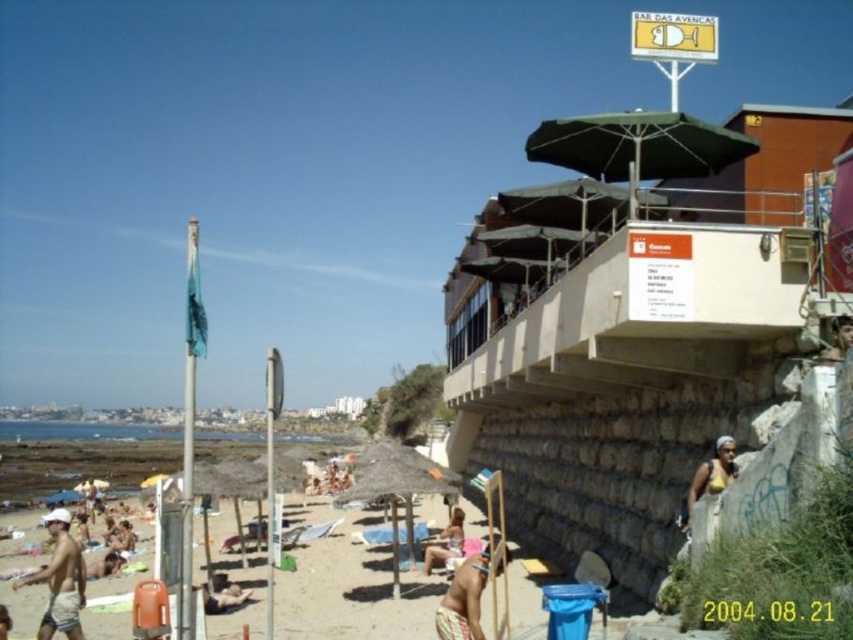
Who is higher up, tan skin person at center or beige straw umbrella at center?

tan skin person at center

How far apart are tan skin person at center and beige straw umbrella at center?

tan skin person at center and beige straw umbrella at center are 38.32 meters apart.

Is point (427, 566) in front of point (79, 493)?

Yes, it is in front of point (79, 493).

Image resolution: width=853 pixels, height=640 pixels. I want to click on tan skin person at center, so click(x=445, y=541).

Who is higher up, tan skin man at lower left or beige straw umbrella at center?

tan skin man at lower left is above.

Is point (68, 625) less distant than point (68, 497)?

Yes, point (68, 625) is closer to viewer.

Does point (78, 621) come behind point (49, 506)?

No.

The image size is (853, 640). I want to click on tan skin man at lower left, so click(61, 579).

Can you confirm if yellow fabric at lower right is smaller than tan skin person at beach center?

Actually, yellow fabric at lower right might be larger than tan skin person at beach center.

Which of these two, yellow fabric at lower right or tan skin person at beach center, stands shorter?

Standing shorter between the two is tan skin person at beach center.

Does point (688, 496) lie behind point (201, 593)?

No.

Locate an element on the screen. yellow fabric at lower right is located at coordinates (709, 477).